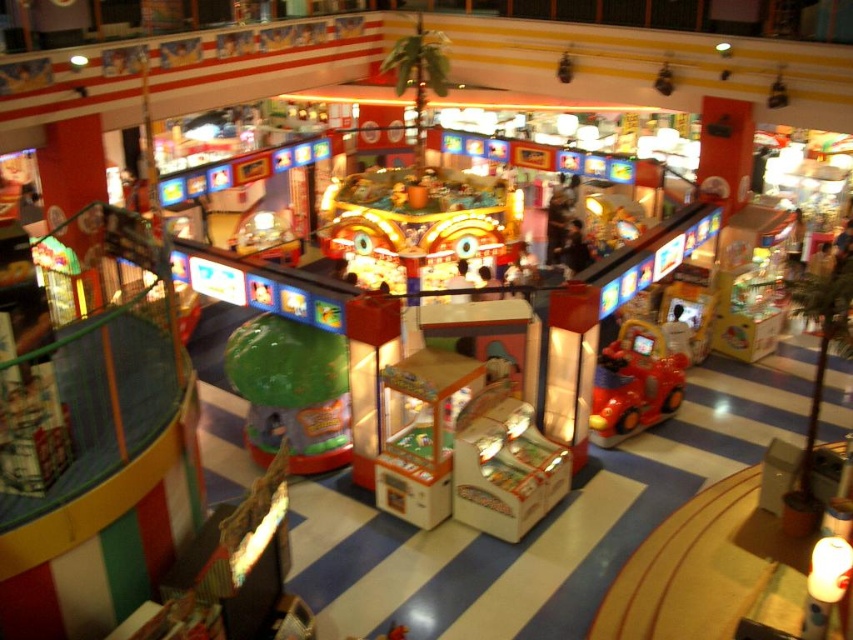
Who is higher up, green matte mushroom at center or shiny red plastic car at center?

shiny red plastic car at center is higher up.

Is green matte mushroom at center to the right of shiny red plastic car at center from the viewer's perspective?

Incorrect, green matte mushroom at center is not on the right side of shiny red plastic car at center.

Is point (318, 468) farther from camera compared to point (635, 340)?

That is False.

The height and width of the screenshot is (640, 853). I want to click on green matte mushroom at center, so [291, 392].

Does shiny metallic claw machine at center appear on the left side of shiny red plastic car at center?

Indeed, shiny metallic claw machine at center is positioned on the left side of shiny red plastic car at center.

Which is in front, point (445, 205) or point (643, 401)?

Point (643, 401) is more forward.

The image size is (853, 640). Find the location of `shiny metallic claw machine at center`. shiny metallic claw machine at center is located at coordinates (418, 225).

Is shiny metallic claw machine at center bigger than green matte mushroom at center?

Indeed, shiny metallic claw machine at center has a larger size compared to green matte mushroom at center.

Between shiny metallic claw machine at center and green matte mushroom at center, which one appears on the right side from the viewer's perspective?

Positioned to the right is shiny metallic claw machine at center.

The height and width of the screenshot is (640, 853). Identify the location of shiny metallic claw machine at center. click(418, 225).